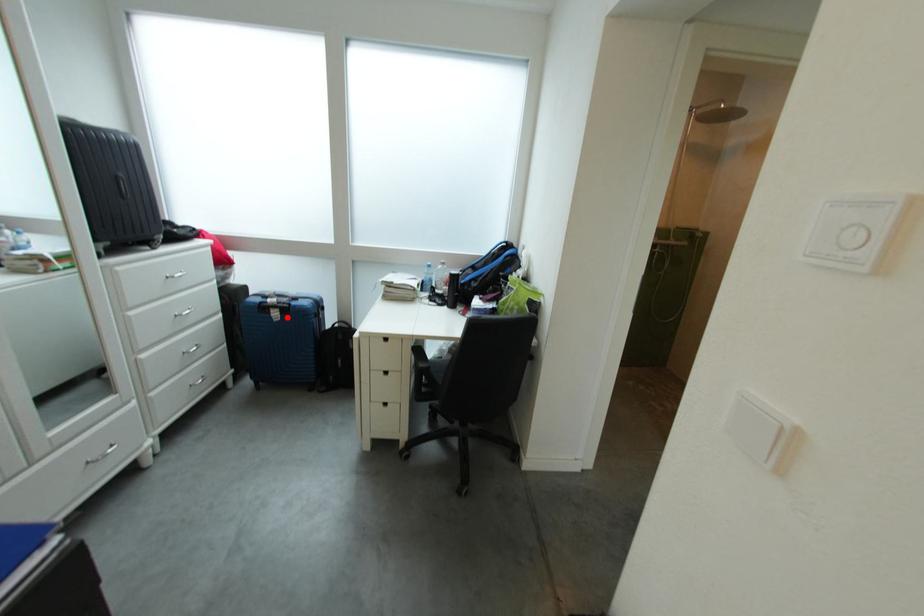
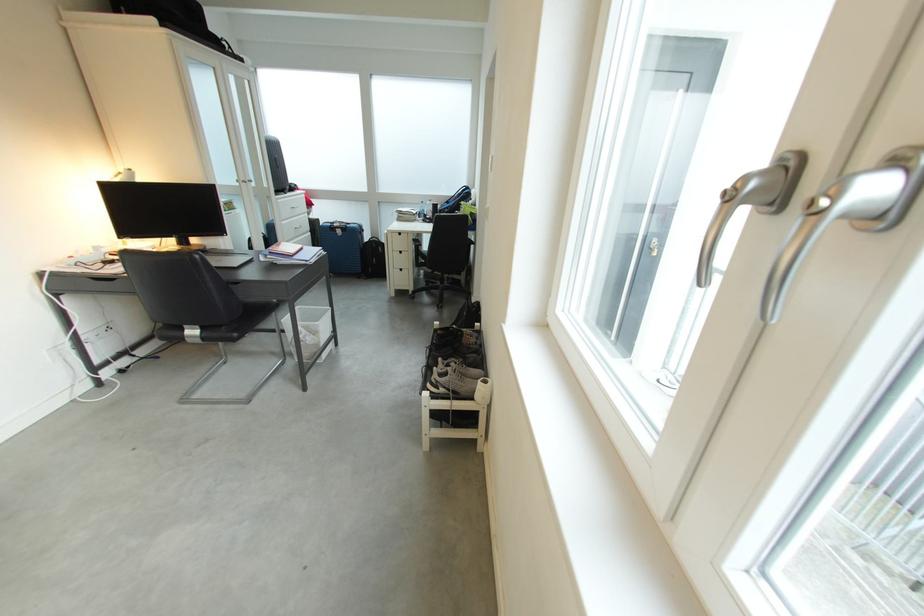
In the second image, find the point that corresponds to the highlighted location in the first image.

(350, 235)